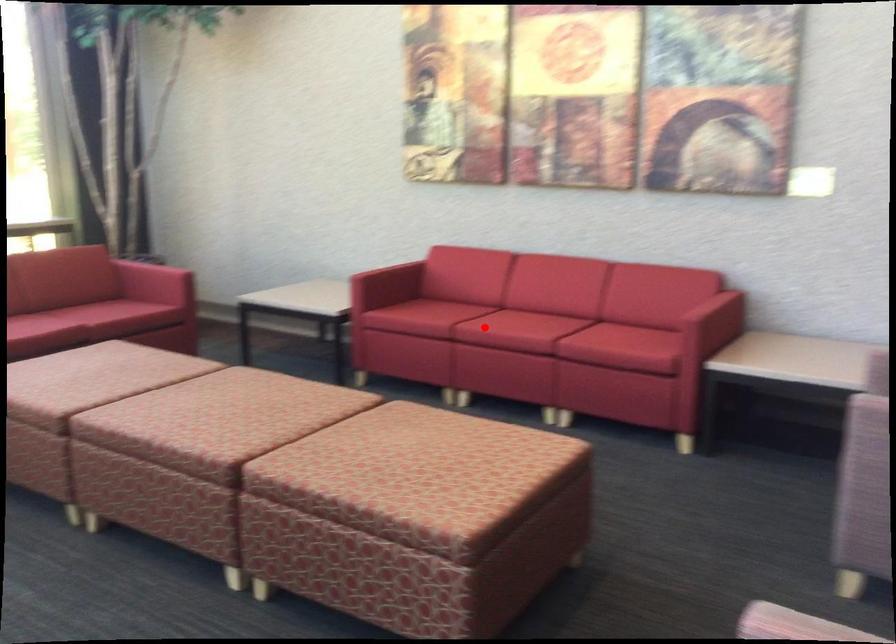
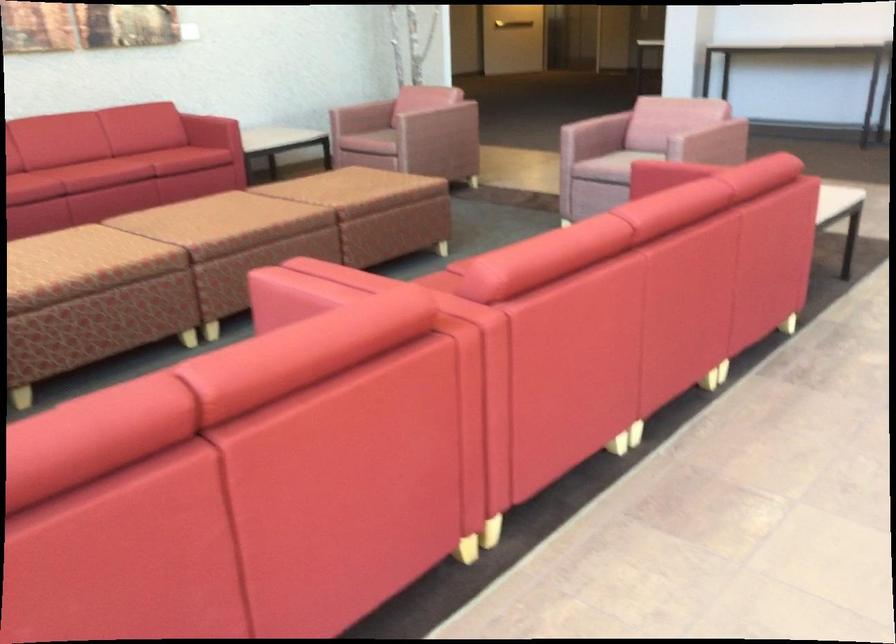
Question: A red point is marked in image1. In image2, is the corresponding 3D point closer to the camera or farther? Reply with the corresponding letter.

Choices:
 (A) The corresponding 3D point is closer.
 (B) The corresponding 3D point is farther.

Answer: (B)